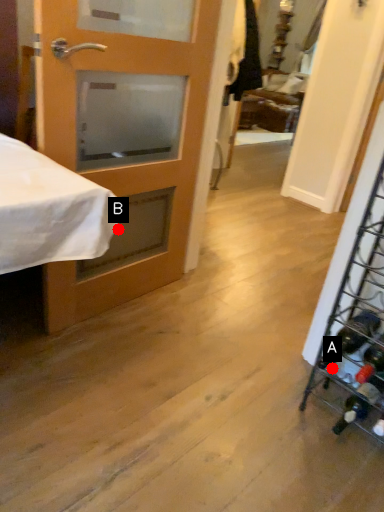
Question: Two points are circled on the image, labeled by A and B beside each circle. Among these points, which one is nearest to the camera?

Choices:
 (A) A is closer
 (B) B is closer

Answer: (A)